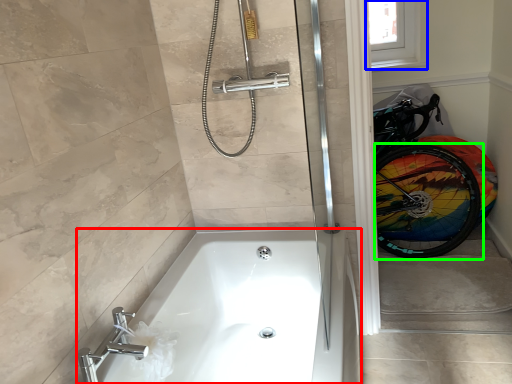
Question: Considering the real-world distances, which object is farthest from bathtub (highlighted by a red box)? window screen (highlighted by a blue box) or bicycle wheel (highlighted by a green box)?

Choices:
 (A) window screen
 (B) bicycle wheel

Answer: (A)